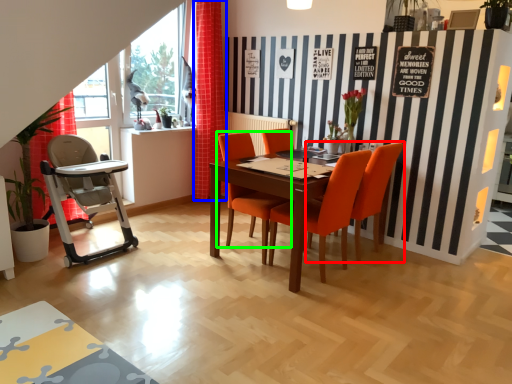
Question: Which is nearer to the chair (highlighted by a red box)? curtain (highlighted by a blue box) or chair (highlighted by a green box).

Choices:
 (A) curtain
 (B) chair

Answer: (B)